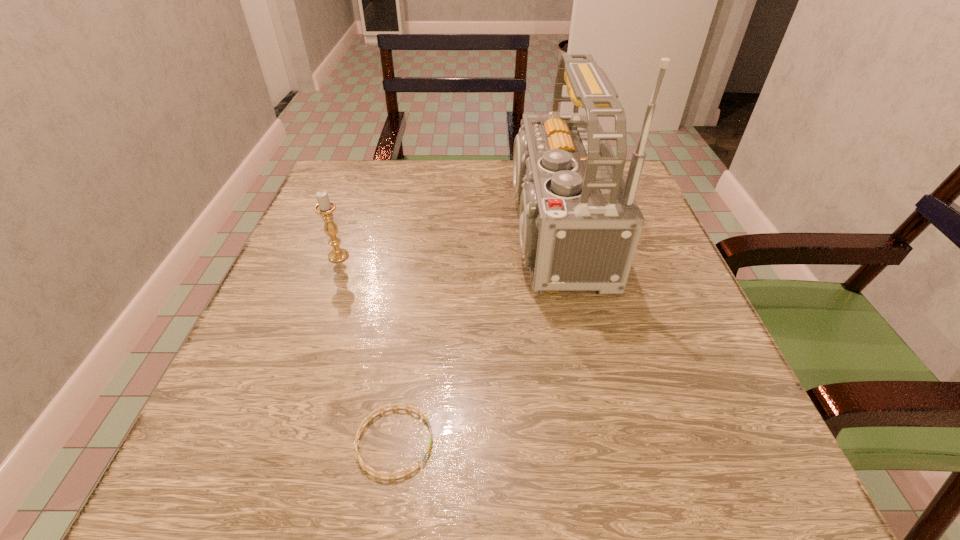
At what (x,y) coordinates should I click in order to perform the action: click on free space located on the surface of the nearest object showing star-shaped elements. Please return your answer as a coordinate pair (x, y). Looking at the image, I should click on (483, 442).

This screenshot has width=960, height=540. What are the coordinates of `object located at the far edge` in the screenshot? It's located at (579, 223).

I want to click on object present at the near edge, so click(x=378, y=474).

You are a GUI agent. You are given a task and a screenshot of the screen. Output one action in this format:
    pyautogui.click(x=<x>, y=<y>)
    Task: Click on the object situated at the left edge
    This screenshot has height=540, width=960.
    Given the screenshot: What is the action you would take?
    pyautogui.click(x=325, y=207)

Where is `object that is at the right edge`? The height and width of the screenshot is (540, 960). object that is at the right edge is located at coordinates (579, 223).

At what (x,y) coordinates should I click in order to perform the action: click on object situated at the far right corner. Please return your answer as a coordinate pair (x, y). Looking at the image, I should click on (579, 223).

In the image, there is a desktop. Where is `free space at the far edge`? The height and width of the screenshot is (540, 960). free space at the far edge is located at coordinates tap(391, 182).

Identify the location of blank space at the near edge of the desktop. This screenshot has height=540, width=960. (494, 497).

Where is `free space at the left edge`? free space at the left edge is located at coordinates (353, 264).

Find the location of a particular element. This screenshot has height=540, width=960. free spot at the right edge of the desktop is located at coordinates (712, 361).